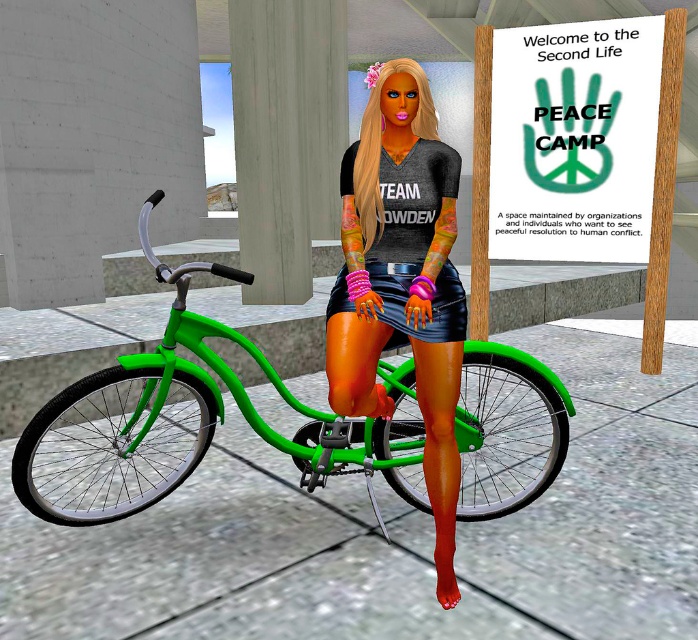
Question: Among these objects, which one is nearest to the camera?

Choices:
 (A) matte black shirt at center
 (B) green matte bicycle at center

Answer: (A)

Question: Which point is farther to the camera?

Choices:
 (A) black leather shorts at center
 (B) shiny leather skirt at center
 (C) wooden signboard at upper right

Answer: (C)

Question: Which object is positioned farthest from the green matte bicycle at center?

Choices:
 (A) black leather shorts at center
 (B) wooden signboard at upper right
 (C) matte black shirt at center

Answer: (B)

Question: Is matte black shirt at center to the right of black leather shorts at center from the viewer's perspective?

Choices:
 (A) no
 (B) yes

Answer: (A)

Question: Does shiny leather skirt at center have a smaller size compared to black leather shorts at center?

Choices:
 (A) yes
 (B) no

Answer: (B)

Question: Is green matte bicycle at center smaller than wooden signboard at upper right?

Choices:
 (A) yes
 (B) no

Answer: (B)